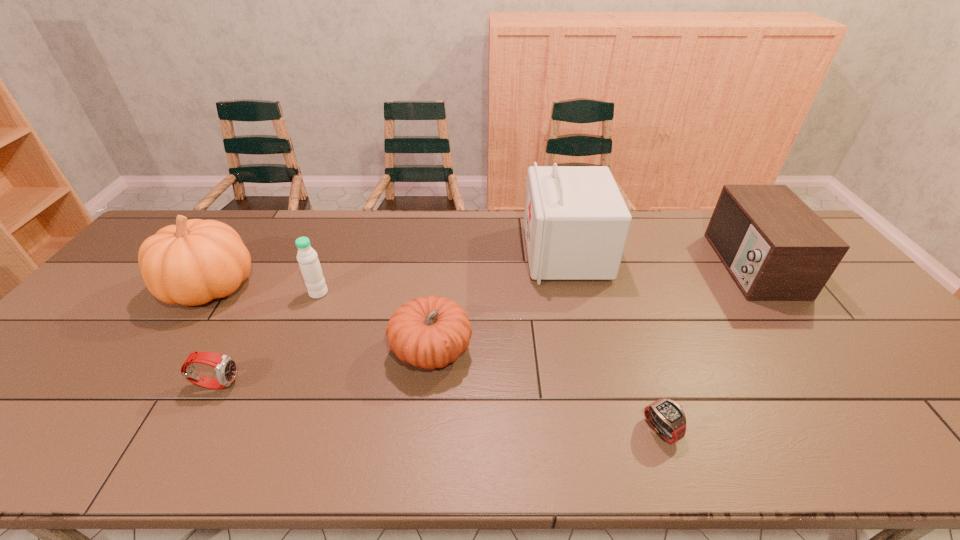
Where is `the shortest object`? The width and height of the screenshot is (960, 540). the shortest object is located at coordinates (667, 417).

Where is `free space located on the front-facing side of the first-aid kit`? free space located on the front-facing side of the first-aid kit is located at coordinates (454, 253).

The image size is (960, 540). I want to click on vacant space located on the front-facing side of the first-aid kit, so click(x=461, y=253).

What are the coordinates of `free region located 0.380m on the front-facing side of the first-aid kit` in the screenshot? It's located at (408, 253).

Identify the location of vacant space situated 0.260m on the back of the taller pumpkin. The image size is (960, 540). (261, 214).

The image size is (960, 540). I want to click on vacant region located on the front-facing side of the radio receiver, so click(687, 265).

Where is `free space located 0.220m on the front-facing side of the radio receiver`? free space located 0.220m on the front-facing side of the radio receiver is located at coordinates (646, 265).

Where is `blank space located 0.150m on the front-facing side of the radio receiver`? The height and width of the screenshot is (540, 960). blank space located 0.150m on the front-facing side of the radio receiver is located at coordinates (668, 265).

You are a GUI agent. You are given a task and a screenshot of the screen. Output one action in this format:
    pyautogui.click(x=<x>, y=<y>)
    Task: Click on the free space located on the right of the fifth object from right to left
    
    Given the screenshot: What is the action you would take?
    pyautogui.click(x=380, y=293)

You are a GUI agent. You are given a task and a screenshot of the screen. Output one action in this format:
    pyautogui.click(x=<x>, y=<y>)
    Task: Click on the free region located 0.260m on the right of the fourth object from right to left
    
    Given the screenshot: What is the action you would take?
    pyautogui.click(x=576, y=351)